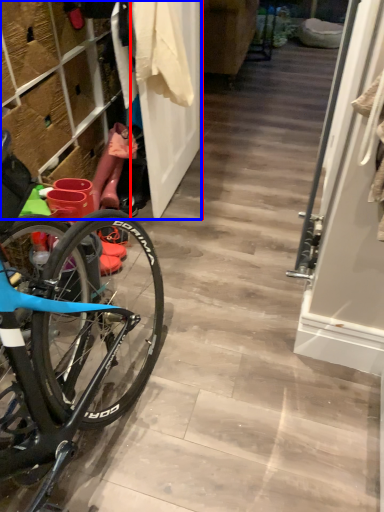
Question: Which point is further to the camera, door (highlighted by a red box) or closet (highlighted by a blue box)?

Choices:
 (A) door
 (B) closet

Answer: (A)